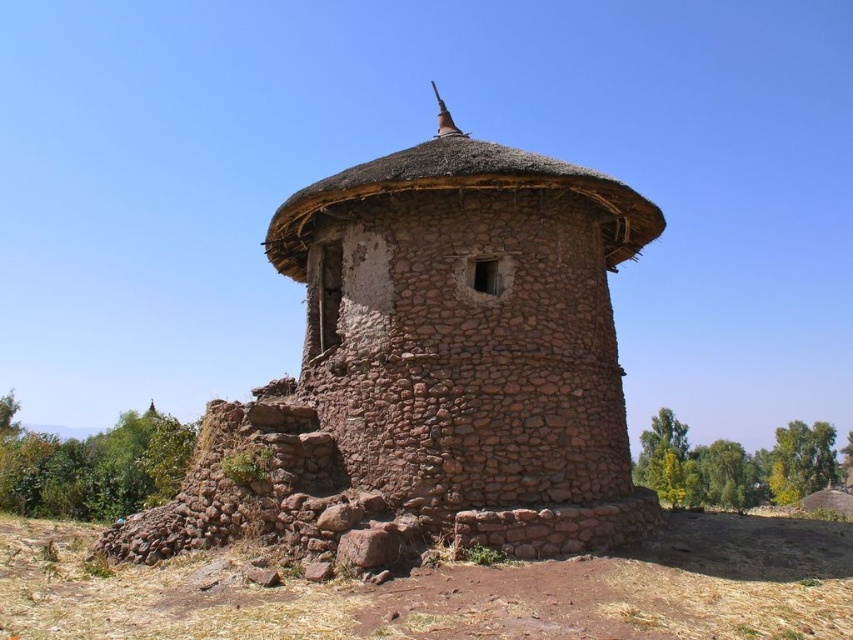
Who is shorter, brown stone tower at center or thatched straw roof at center?

With less height is thatched straw roof at center.

Is brown stone tower at center further to camera compared to thatched straw roof at center?

No, it is in front of thatched straw roof at center.

Between point (338, 177) and point (619, 228), which one is positioned in front?

Point (338, 177)

Locate an element on the screen. brown stone tower at center is located at coordinates (473, 339).